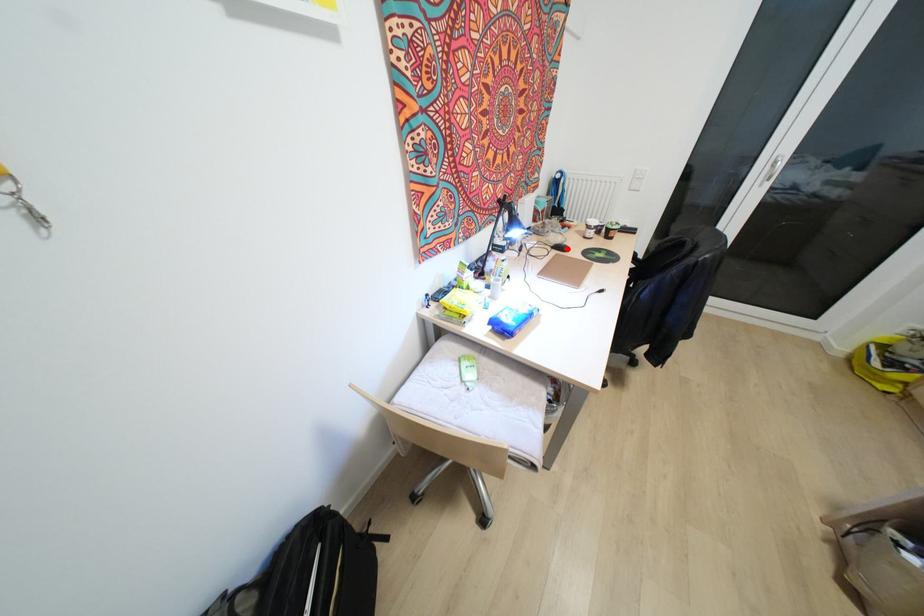
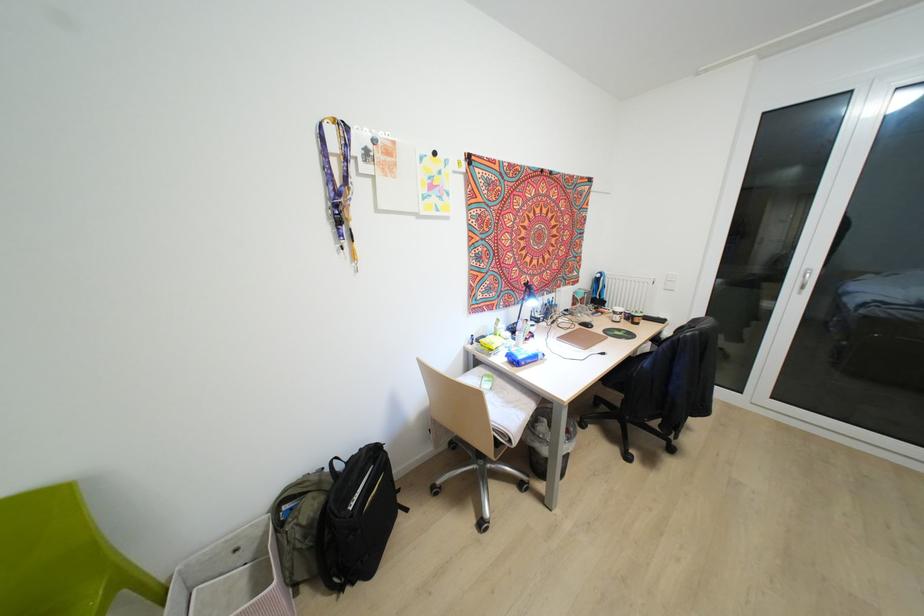
Locate, in the second image, the point that corresponds to the highlighted location in the first image.

(591, 326)